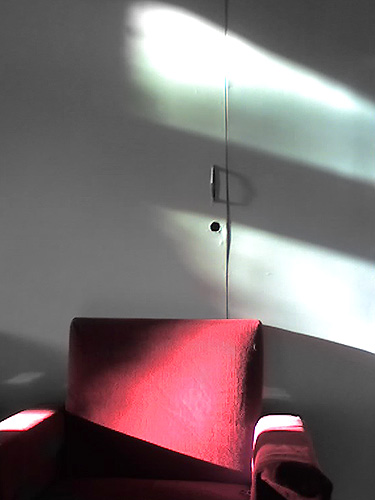
Locate an element on the screen. The height and width of the screenshot is (500, 375). light cast on wall is located at coordinates (285, 280), (247, 73).